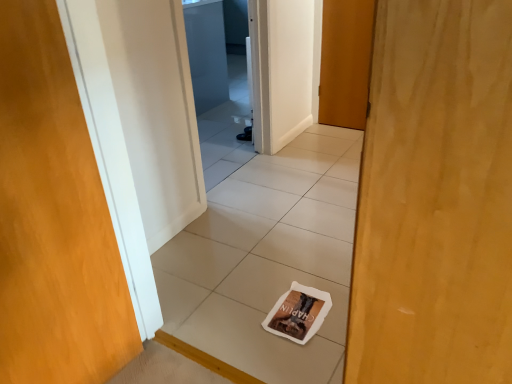
The image size is (512, 384). I want to click on vacant area that lies to the right of brown paper magazine at center, so click(336, 299).